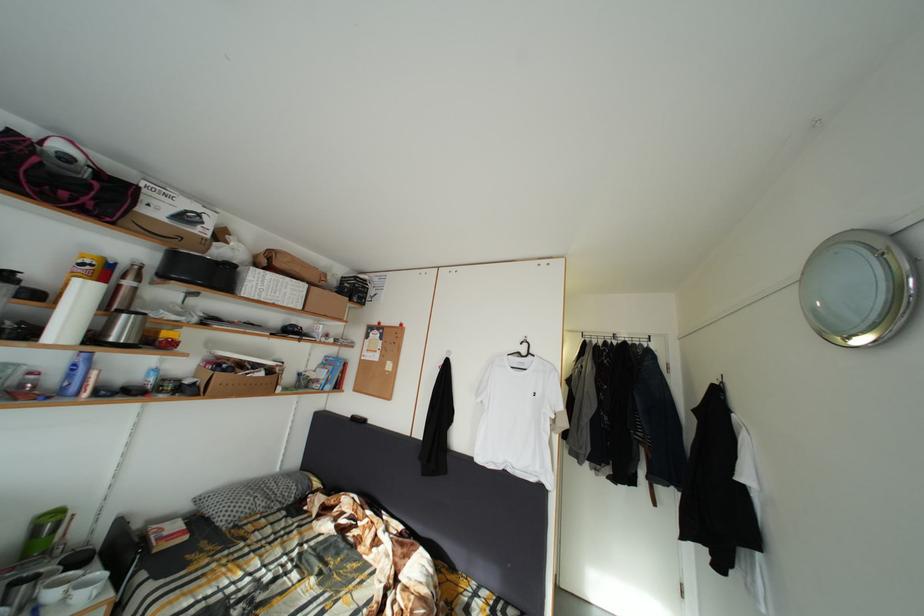
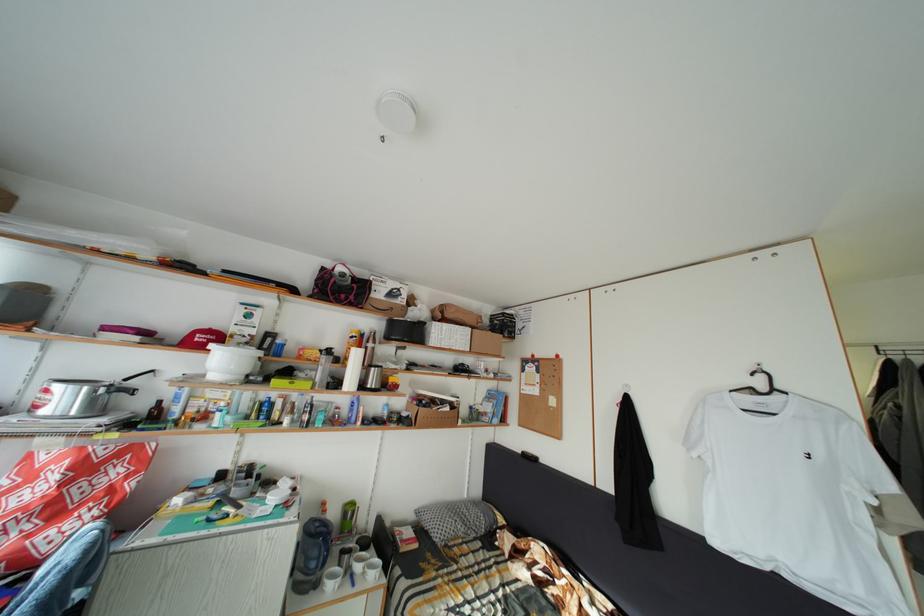
Question: The images are taken continuously from a first-person perspective. In which direction is your viewpoint rotating?

Choices:
 (A) Left
 (B) Right
 (C) Up
 (D) Down

Answer: (A)